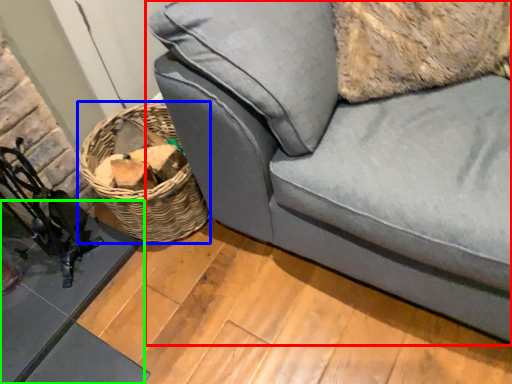
Question: Considering the real-world distances, which object is farthest from studio couch (highlighted by a red box)? basket (highlighted by a blue box) or table (highlighted by a green box)?

Choices:
 (A) basket
 (B) table

Answer: (B)